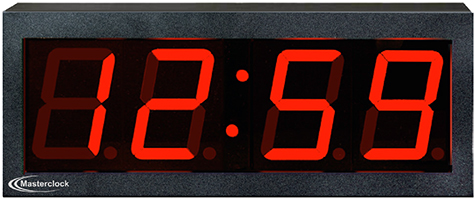
Find the location of a particular element. The height and width of the screenshot is (200, 476). unhighlighted numbers on clock is located at coordinates (82, 54), (51, 85), (39, 130), (54, 153), (61, 105), (149, 76), (193, 128), (271, 125), (337, 74), (367, 132).